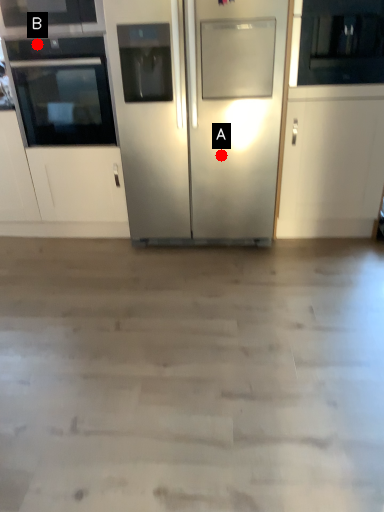
Question: Two points are circled on the image, labeled by A and B beside each circle. Which point is farther from the camera taking this photo?

Choices:
 (A) A is further
 (B) B is further

Answer: (A)